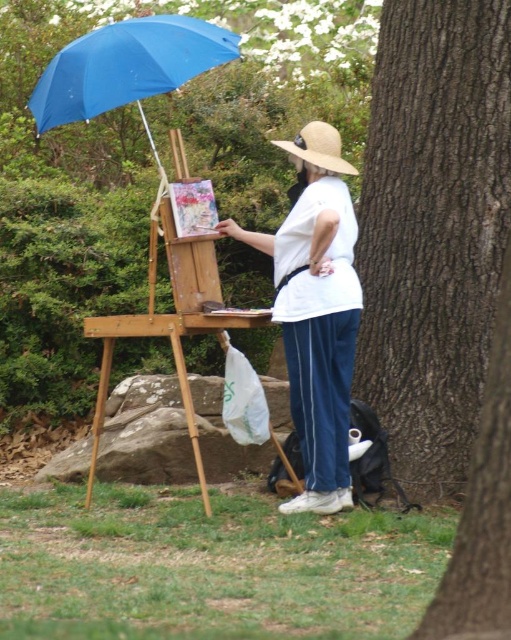
You are an artist who wants to ensure your wooden easel at center is visible in your painting. Considering the brown rough bark tree at right, will the tree block the view of the easel?

The brown rough bark tree at right occupies less space than wooden easel at center, so the tree will not block the view of the easel since it is smaller in size.

You are an artist setting up your painting equipment. You notice a brown rough bark tree at right and a white cotton shirt at center. Which object is wider?

The brown rough bark tree at right is wider than the white cotton shirt at center.

You are standing in the park and want to take a photo of the brown rough bark tree at right. If your camera can focus on objects up to 5 meters away, will you need to move closer or farther away to get a clear shot?

The brown rough bark tree at right is 5.05 meters away from you. Since your camera can focus up to 5 meters, you need to move slightly farther away to ensure it falls within the camera range. Alternatively, moving 5 centimeters back would bring the distance to 5.1 meters, which might still be out of range. Wait, actually, since it is already 5.05 meters, which is just beyond the 5 meter limit, moving 5 centimeters closer would reduce the distance to 4.95 meters, allowing the camera to focus properly. Hmm, I